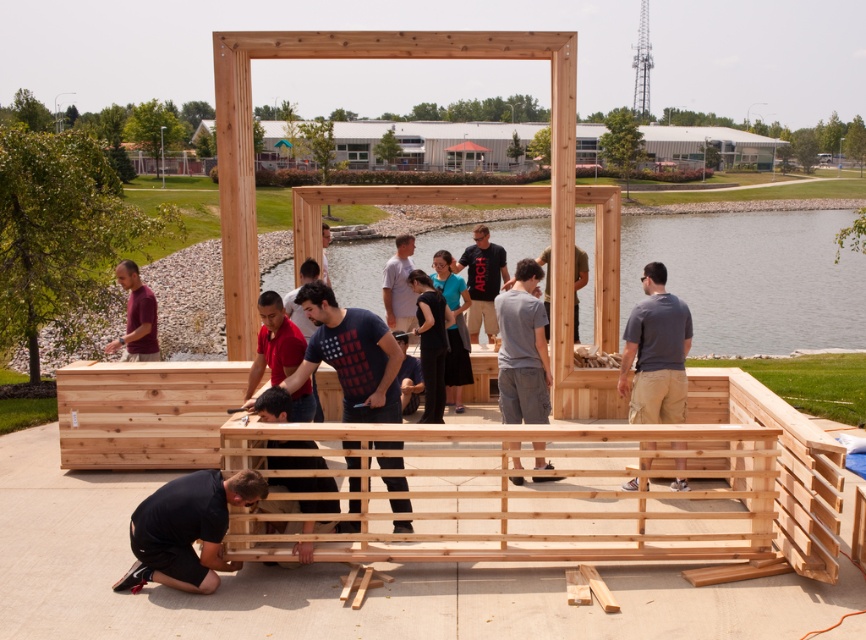
Looking at this image, which of these two, black matte construction worker at lower left or maroon shirt at left, stands shorter?

Standing shorter between the two is black matte construction worker at lower left.

Which is in front, point (158, 513) or point (144, 298)?

Point (158, 513) is more forward.

Where is `black matte construction worker at lower left`? The image size is (866, 640). black matte construction worker at lower left is located at coordinates pyautogui.click(x=186, y=529).

Image resolution: width=866 pixels, height=640 pixels. Identify the location of black matte construction worker at lower left. (186, 529).

Does clear water at center lie behind black matte construction worker at lower left?

That is True.

Between clear water at center and black matte construction worker at lower left, which one has more height?

Standing taller between the two is clear water at center.

Describe the element at coordinates (753, 276) in the screenshot. I see `clear water at center` at that location.

Identify the location of clear water at center. (753, 276).

Is clear water at center bigger than maroon shirt at left?

Yes, clear water at center is bigger than maroon shirt at left.

This screenshot has width=866, height=640. What do you see at coordinates (753, 276) in the screenshot?
I see `clear water at center` at bounding box center [753, 276].

I want to click on clear water at center, so click(x=753, y=276).